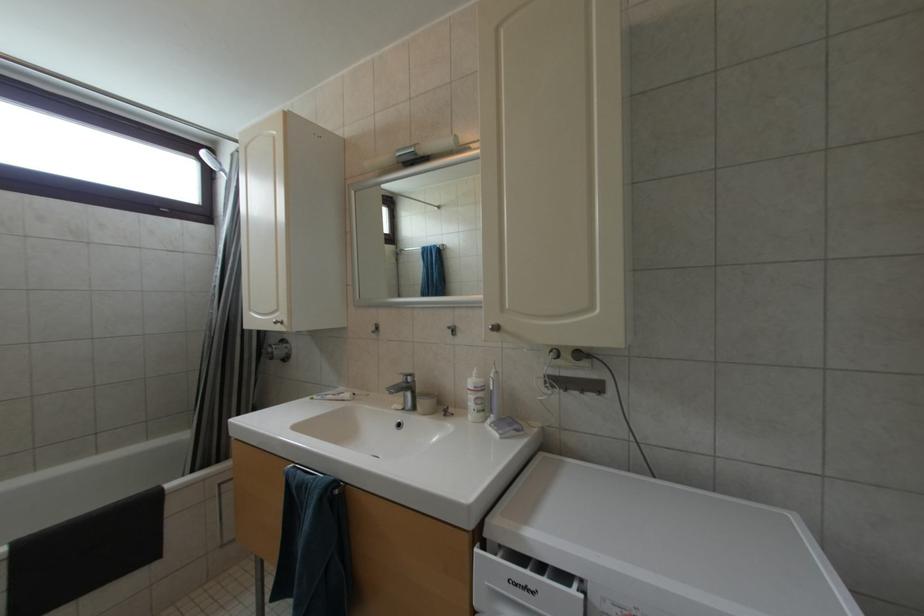
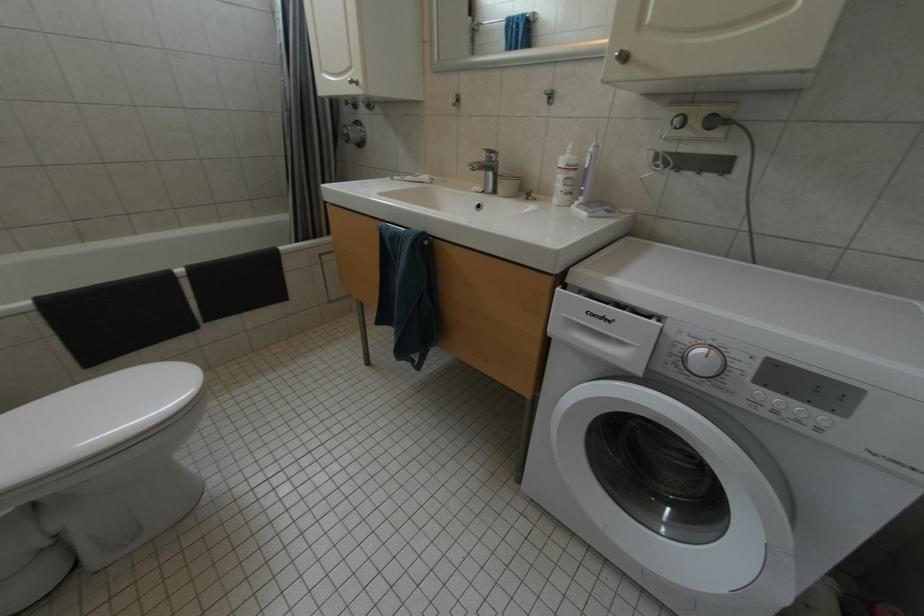
Question: The first image is from the beginning of the video and the second image is from the end. How did the camera likely rotate when shooting the video?

Choices:
 (A) Left
 (B) Right
 (C) Up
 (D) Down

Answer: (D)